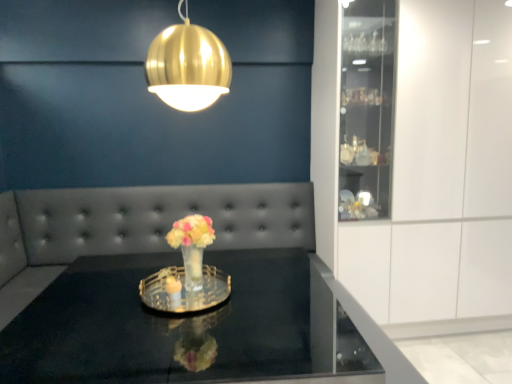
What do you see at coordinates (426, 167) in the screenshot? The height and width of the screenshot is (384, 512). I see `white glossy cabinet at right` at bounding box center [426, 167].

This screenshot has width=512, height=384. Find the location of `white glossy cabinet at right`. white glossy cabinet at right is located at coordinates (426, 167).

You are a GUI agent. You are given a task and a screenshot of the screen. Output one action in this format:
    pyautogui.click(x=<x>, y=<y>)
    Task: Click on the translucent glass vase at center
    The height and width of the screenshot is (384, 512).
    Given the screenshot: What is the action you would take?
    pyautogui.click(x=192, y=246)

This screenshot has width=512, height=384. What are the coordinates of `clear glass tray at center` in the screenshot? It's located at (184, 290).

Describe the element at coordinates (136, 226) in the screenshot. I see `clear glass vase at center` at that location.

Locate an element on the screen. This screenshot has height=384, width=512. black glass table at center is located at coordinates (166, 325).

Considering the positions of point (126, 234) and point (198, 288), is point (126, 234) closer or farther from the camera than point (198, 288)?

Point (126, 234).

Can you confirm if clear glass vase at center is shorter than translucent glass vase at center?

Incorrect, the height of clear glass vase at center does not fall short of that of translucent glass vase at center.

Is clear glass vase at center thinner than translucent glass vase at center?

In fact, clear glass vase at center might be wider than translucent glass vase at center.

Would you say clear glass vase at center is to the left or to the right of translucent glass vase at center in the picture?

Clearly, clear glass vase at center is on the left of translucent glass vase at center in the image.

Is point (205, 289) farther from viewer compared to point (200, 203)?

No.

Locate an element on the screen. This screenshot has height=384, width=512. glass plate on the right of clear glass vase at center is located at coordinates (184, 290).

Between clear glass tray at center and clear glass vase at center, which one is positioned in front?

clear glass tray at center.

From the image's perspective, is clear glass tray at center over clear glass vase at center?

No.

Identify the location of lamp above the white glossy cabinet at right (from a real-world perspective). (188, 66).

Considering the sizes of white glossy cabinet at right and gold metallic sphere at upper center in the image, is white glossy cabinet at right bigger or smaller than gold metallic sphere at upper center?

Clearly, white glossy cabinet at right is larger in size than gold metallic sphere at upper center.

Considering the relative sizes of white glossy cabinet at right and gold metallic sphere at upper center in the image provided, is white glossy cabinet at right taller than gold metallic sphere at upper center?

Correct, white glossy cabinet at right is much taller as gold metallic sphere at upper center.

Is white glossy cabinet at right inside or outside of gold metallic sphere at upper center?

white glossy cabinet at right lies outside gold metallic sphere at upper center.

Which object is wider, translucent glass vase at center or clear glass vase at center?

With larger width is clear glass vase at center.

Is translucent glass vase at center completely or partially outside of clear glass vase at center?

That's correct, translucent glass vase at center is outside of clear glass vase at center.

From the picture: Can you confirm if translucent glass vase at center is shorter than clear glass vase at center?

Indeed, translucent glass vase at center has a lesser height compared to clear glass vase at center.

In the scene shown: What's the angular difference between translucent glass vase at center and clear glass vase at center's facing directions?

79.9 degrees separate the facing orientations of translucent glass vase at center and clear glass vase at center.

Which object is wider, clear glass tray at center or translucent glass vase at center?

Wider between the two is clear glass tray at center.

Is clear glass tray at center aimed at translucent glass vase at center?

Yes, clear glass tray at center is oriented towards translucent glass vase at center.

The image size is (512, 384). Identify the location of floral arrangement that appears above the clear glass tray at center (from the image's perspective). (192, 246).

Is clear glass tray at center bigger than translucent glass vase at center?

Incorrect, clear glass tray at center is not larger than translucent glass vase at center.

Locate an element on the screen. Image resolution: width=512 pixels, height=384 pixels. lamp above the clear glass vase at center (from a real-world perspective) is located at coordinates click(x=188, y=66).

From the image's perspective, is gold metallic sphere at upper center located beneath clear glass vase at center?

Actually, gold metallic sphere at upper center appears above clear glass vase at center in the image.

From a real-world perspective, is gold metallic sphere at upper center located higher than clear glass vase at center?

Correct, in the physical world, gold metallic sphere at upper center is higher than clear glass vase at center.

Is gold metallic sphere at upper center facing towards clear glass vase at center?

No, gold metallic sphere at upper center does not turn towards clear glass vase at center.

Looking at the image, does white glossy cabinet at right seem bigger or smaller compared to translucent glass vase at center?

Considering their sizes, white glossy cabinet at right takes up more space than translucent glass vase at center.

Considering the positions of objects white glossy cabinet at right and translucent glass vase at center in the image provided, who is behind, white glossy cabinet at right or translucent glass vase at center?

white glossy cabinet at right is further away from the camera.

Considering the positions of objects white glossy cabinet at right and translucent glass vase at center in the image provided, who is more to the left, white glossy cabinet at right or translucent glass vase at center?

translucent glass vase at center is more to the left.

Considering the sizes of white glossy cabinet at right and translucent glass vase at center in the image, is white glossy cabinet at right taller or shorter than translucent glass vase at center?

Clearly, white glossy cabinet at right is taller compared to translucent glass vase at center.

The width and height of the screenshot is (512, 384). Identify the location of floral arrangement on the right of the clear glass vase at center. (192, 246).

Find the location of a particular element. swivel chair below the clear glass tray at center (from a real-world perspective) is located at coordinates (136, 226).

From the image, which object appears to be nearer to black glass table at center, white glossy cabinet at right or clear glass vase at center?

clear glass vase at center is positioned closer to the anchor black glass table at center.

Which object lies further to the anchor point white glossy cabinet at right, gold metallic sphere at upper center or black glass table at center?

Based on the image, gold metallic sphere at upper center appears to be further to white glossy cabinet at right.

Based on their spatial positions, is clear glass tray at center or black glass table at center further from clear glass vase at center?

clear glass tray at center is positioned further to the anchor clear glass vase at center.

In the scene shown: Which object lies further to the anchor point clear glass vase at center, gold metallic sphere at upper center or translucent glass vase at center?

Among the two, gold metallic sphere at upper center is located further to clear glass vase at center.

Based on their spatial positions, is clear glass vase at center or gold metallic sphere at upper center closer to white glossy cabinet at right?

clear glass vase at center.

Estimate the real-world distances between objects in this image. Which object is further from translucent glass vase at center, gold metallic sphere at upper center or clear glass vase at center?

Based on the image, clear glass vase at center appears to be further to translucent glass vase at center.

Which object lies nearer to the anchor point gold metallic sphere at upper center, translucent glass vase at center or clear glass tray at center?

translucent glass vase at center lies closer to gold metallic sphere at upper center than the other object.

When comparing their distances from white glossy cabinet at right, does gold metallic sphere at upper center or translucent glass vase at center seem closer?

Among the two, translucent glass vase at center is located nearer to white glossy cabinet at right.

Locate an element on the screen. Image resolution: width=512 pixels, height=384 pixels. floral arrangement positioned between black glass table at center and clear glass vase at center from near to far is located at coordinates (192, 246).

Where is `swivel chair between gold metallic sphere at upper center and black glass table at center vertically`? swivel chair between gold metallic sphere at upper center and black glass table at center vertically is located at coordinates (136, 226).

Locate an element on the screen. This screenshot has width=512, height=384. table between clear glass vase at center and white glossy cabinet at right in the horizontal direction is located at coordinates (166, 325).

This screenshot has width=512, height=384. I want to click on lamp between black glass table at center and white glossy cabinet at right in the horizontal direction, so click(188, 66).